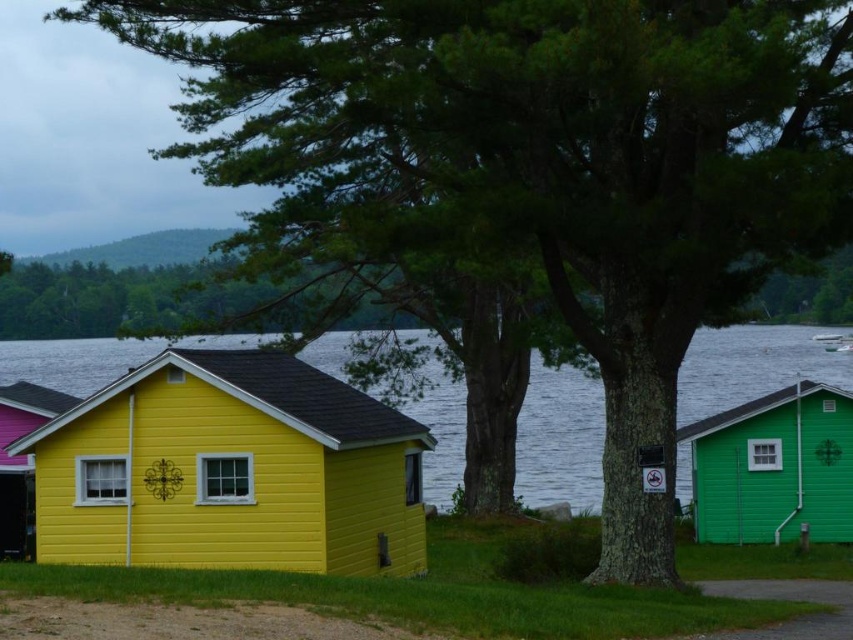
Question: Which point is closer to the camera?

Choices:
 (A) green matte wood cabin at right
 (B) transparent water at lower center
 (C) yellow wood cabin at center

Answer: (C)

Question: From the image, what is the correct spatial relationship of transparent water at lower center in relation to green matte wood cabin at right?

Choices:
 (A) above
 (B) below

Answer: (A)

Question: Is yellow wood cabin at center smaller than transparent water at lower center?

Choices:
 (A) yes
 (B) no

Answer: (A)

Question: Among these points, which one is nearest to the camera?

Choices:
 (A) (704, 484)
 (B) (744, 387)
 (C) (254, 554)
 (D) (6, 444)

Answer: (C)

Question: Is the position of yellow wood cabin at center less distant than that of transparent water at lower center?

Choices:
 (A) yes
 (B) no

Answer: (A)

Question: Considering the real-world distances, which object is closest to the green matte wood cabin at right?

Choices:
 (A) yellow wood cabin at lower left
 (B) transparent water at lower center
 (C) yellow wood cabin at center

Answer: (C)